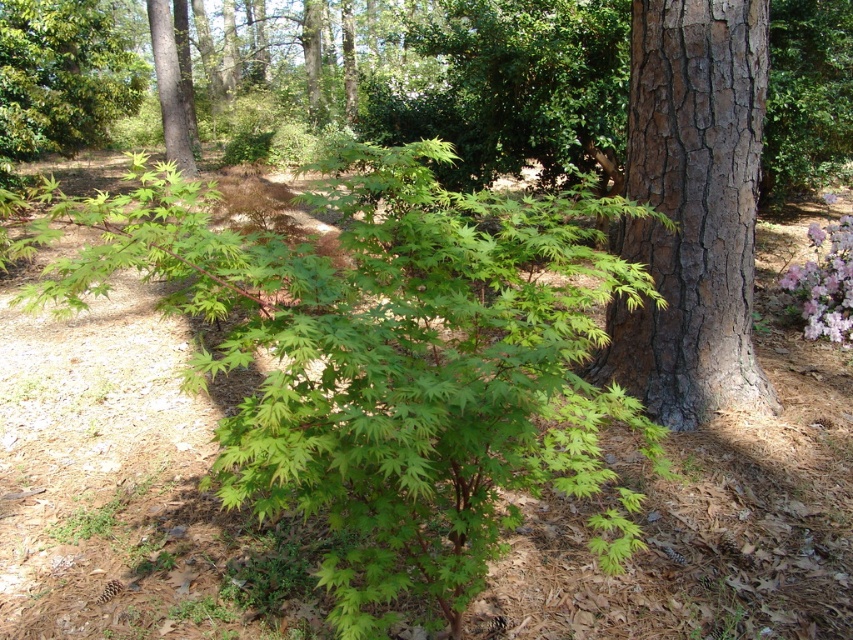
Question: Which point is farther to the camera?

Choices:
 (A) green leafy maple at center
 (B) pink matte flowers at lower right
 (C) smooth brown bark at right
 (D) smooth brown tree trunk at upper center

Answer: (D)

Question: Considering the relative positions of green leafy maple at center and pink matte flowers at lower right in the image provided, where is green leafy maple at center located with respect to pink matte flowers at lower right?

Choices:
 (A) below
 (B) above

Answer: (A)

Question: Is smooth brown bark at right smaller than pink matte flowers at lower right?

Choices:
 (A) yes
 (B) no

Answer: (B)

Question: Which object is positioned farthest from the pink matte flowers at lower right?

Choices:
 (A) smooth brown tree trunk at upper center
 (B) smooth brown bark at right
 (C) green leafy maple at center

Answer: (A)

Question: Is smooth brown bark at right closer to the viewer compared to pink matte flowers at lower right?

Choices:
 (A) no
 (B) yes

Answer: (B)

Question: Which object appears farthest from the camera in this image?

Choices:
 (A) smooth brown bark at right
 (B) green leafy maple at center
 (C) pink matte flowers at lower right
 (D) smooth brown tree trunk at upper center

Answer: (D)